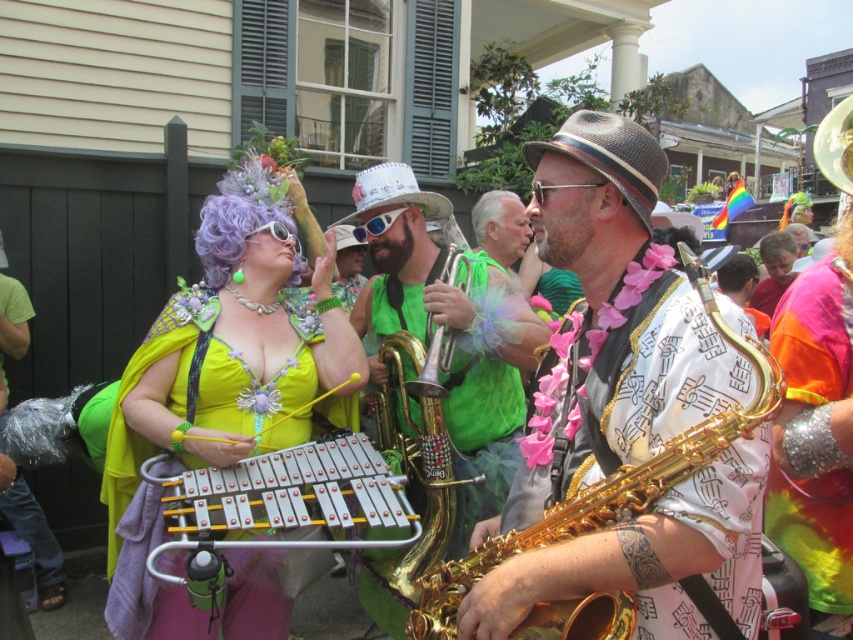
Question: Among these points, which one is farthest from the camera?

Choices:
 (A) (775, 237)
 (B) (831, 340)
 (C) (518, 198)
 (D) (9, 332)

Answer: (A)

Question: Considering the real-world distances, which object is farthest from the gray synthetic wig at center?

Choices:
 (A) matte yellow dress at center
 (B) shiny metallic saxophone at left
 (C) orange fabric shirt at center

Answer: (B)

Question: Is shiny sequined arm band at center above orange fabric shirt at center?

Choices:
 (A) no
 (B) yes

Answer: (A)

Question: Which point is closer to the camera?

Choices:
 (A) (285, 616)
 (B) (793, 426)
 (C) (555, 394)

Answer: (C)

Question: Is matte yellow dress at center to the right of orange fabric shirt at center from the viewer's perspective?

Choices:
 (A) no
 (B) yes

Answer: (A)

Question: Is gold shiny saxophone at center further to the viewer compared to shiny sequined arm band at center?

Choices:
 (A) no
 (B) yes

Answer: (A)